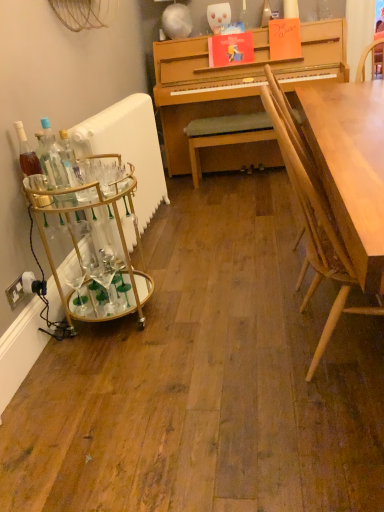
Question: From the image's perspective, does gold metallic bar cart at left appear lower than white plastic power outlet at lower left?

Choices:
 (A) yes
 (B) no

Answer: (B)

Question: Does gold metallic bar cart at left appear on the left side of white plastic power outlet at lower left?

Choices:
 (A) no
 (B) yes

Answer: (A)

Question: Is gold metallic bar cart at left located outside white plastic power outlet at lower left?

Choices:
 (A) no
 (B) yes

Answer: (B)

Question: From a real-world perspective, is gold metallic bar cart at left below white plastic power outlet at lower left?

Choices:
 (A) no
 (B) yes

Answer: (A)

Question: Does gold metallic bar cart at left have a greater height compared to white plastic power outlet at lower left?

Choices:
 (A) no
 (B) yes

Answer: (B)

Question: From the image's perspective, is white glossy radiator at left above or below white plastic power outlet at lower left?

Choices:
 (A) below
 (B) above

Answer: (B)

Question: From a real-world perspective, is white glossy radiator at left positioned above or below white plastic power outlet at lower left?

Choices:
 (A) below
 (B) above

Answer: (B)

Question: Is point (127, 103) closer or farther from the camera than point (33, 280)?

Choices:
 (A) farther
 (B) closer

Answer: (A)

Question: In the image, is white glossy radiator at left on the left side or the right side of white plastic power outlet at lower left?

Choices:
 (A) right
 (B) left

Answer: (A)

Question: Visually, is white plastic power outlet at lower left positioned to the left or to the right of gold metallic bar cart at left?

Choices:
 (A) right
 (B) left

Answer: (B)

Question: In terms of width, does white plastic power outlet at lower left look wider or thinner when compared to gold metallic bar cart at left?

Choices:
 (A) wide
 (B) thin

Answer: (B)

Question: Relative to gold metallic bar cart at left, is white plastic power outlet at lower left in front or behind?

Choices:
 (A) behind
 (B) front

Answer: (A)

Question: From the image's perspective, is white plastic power outlet at lower left located above or below gold metallic bar cart at left?

Choices:
 (A) above
 (B) below

Answer: (B)

Question: In the image, is clear glass bottle at left, placed as the 2th bottle when sorted from left to right, positioned in front of or behind light brown wood chair at right?

Choices:
 (A) behind
 (B) front

Answer: (A)

Question: From the image's perspective, is clear glass bottle at left, the 1th bottle in the right-to-left sequence, above or below light brown wood chair at right?

Choices:
 (A) above
 (B) below

Answer: (A)